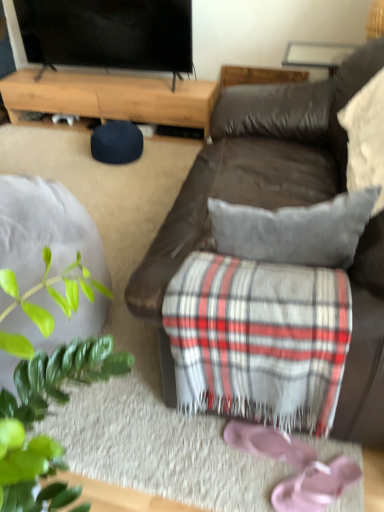
Question: Considering the positions of light brown wood at upper left and pink fabric flip-flops at lower right in the image, is light brown wood at upper left wider or thinner than pink fabric flip-flops at lower right?

Choices:
 (A) thin
 (B) wide

Answer: (B)

Question: Is light brown wood at upper left bigger or smaller than pink fabric flip-flops at lower right?

Choices:
 (A) small
 (B) big

Answer: (B)

Question: Estimate the real-world distances between objects in this image. Which object is farther from the flat screen tv at upper left?

Choices:
 (A) pink fabric flip-flops at lower right
 (B) pink suede shoe at lower center
 (C) light brown wood at upper left
 (D) brown leather couch at center
 (E) white textured pillow at upper right

Answer: (A)

Question: Which of these objects is positioned closest to the flat screen tv at upper left?

Choices:
 (A) brown leather couch at center
 (B) pink suede shoe at lower center
 (C) light brown wood at upper left
 (D) pink fabric flip-flops at lower right
 (E) white textured pillow at upper right

Answer: (C)